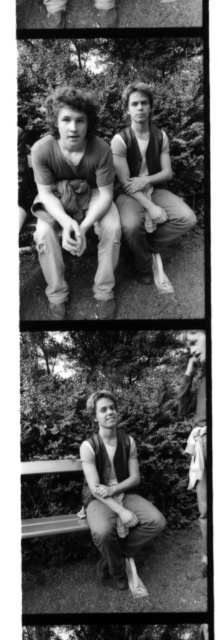
Question: Does matte brown hair at center lie in front of matte black tank top at center?

Choices:
 (A) no
 (B) yes

Answer: (B)

Question: Among these points, which one is farthest from the camera?

Choices:
 (A) (112, 289)
 (B) (109, 420)
 (C) (189, 472)
 (D) (132, 243)

Answer: (D)

Question: Where is matte brown hair at center located in relation to matte black tank top at center in the image?

Choices:
 (A) below
 (B) above

Answer: (B)

Question: Which point is farther from the camera taking this photo?

Choices:
 (A) (148, 257)
 (B) (204, 426)
 (C) (127, 481)

Answer: (A)

Question: Which of the following is the farthest from the observer?

Choices:
 (A) (63, 129)
 (B) (97, 403)
 (C) (148, 276)

Answer: (C)

Question: Can you confirm if matte brown hair at center is positioned below matte brown vest at right?

Choices:
 (A) yes
 (B) no

Answer: (B)